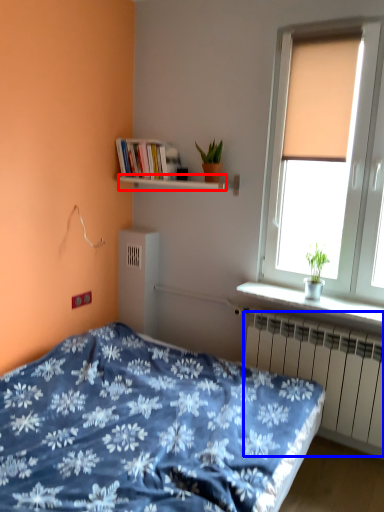
Question: Which of the following is the closest to the observer, window sill (highlighted by a red box) or radiator (highlighted by a blue box)?

Choices:
 (A) window sill
 (B) radiator

Answer: (B)